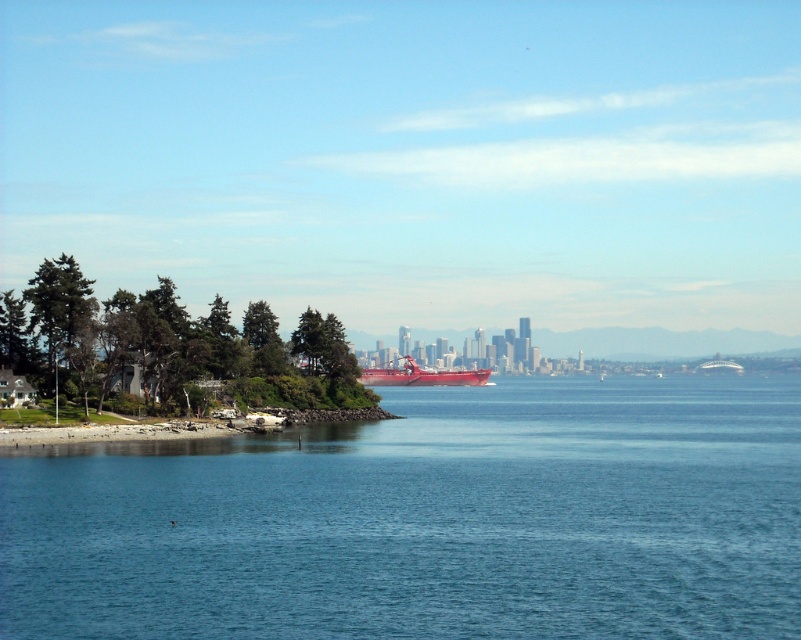
Question: Which point is closer to the camera?

Choices:
 (A) (544, 605)
 (B) (427, 380)

Answer: (A)

Question: Where is blue water at lower center located in relation to shiny red boat at center in the image?

Choices:
 (A) left
 (B) right

Answer: (B)

Question: Which of the following is the closest to the observer?

Choices:
 (A) (405, 369)
 (B) (473, 579)

Answer: (B)

Question: In this image, where is blue water at lower center located relative to shiny red boat at center?

Choices:
 (A) below
 (B) above

Answer: (A)

Question: Can you confirm if blue water at lower center is positioned above shiny red boat at center?

Choices:
 (A) no
 (B) yes

Answer: (A)